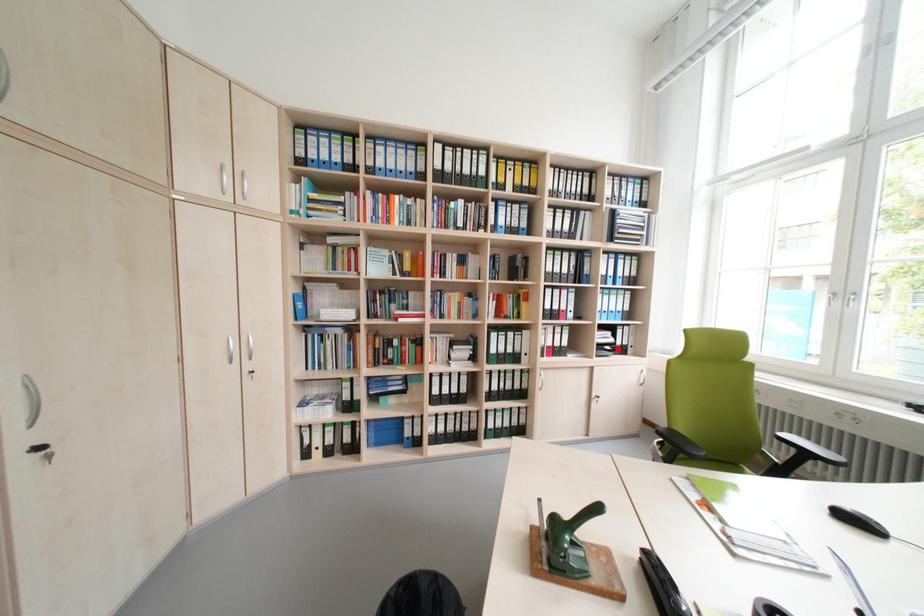
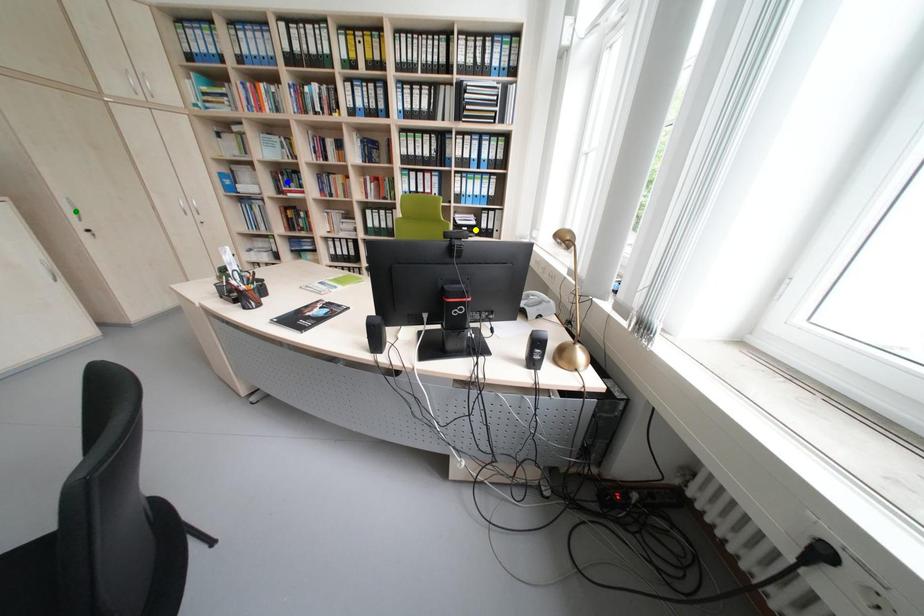
Question: I am providing you with two images of the same scene from different viewpoints. A red point is marked on the first image. You are given multiple points on the second image. Which point in image 2 represents the same 3d spot as the red point in image 1?

Choices:
 (A) blue point
 (B) green point
 (C) yellow point

Answer: (C)